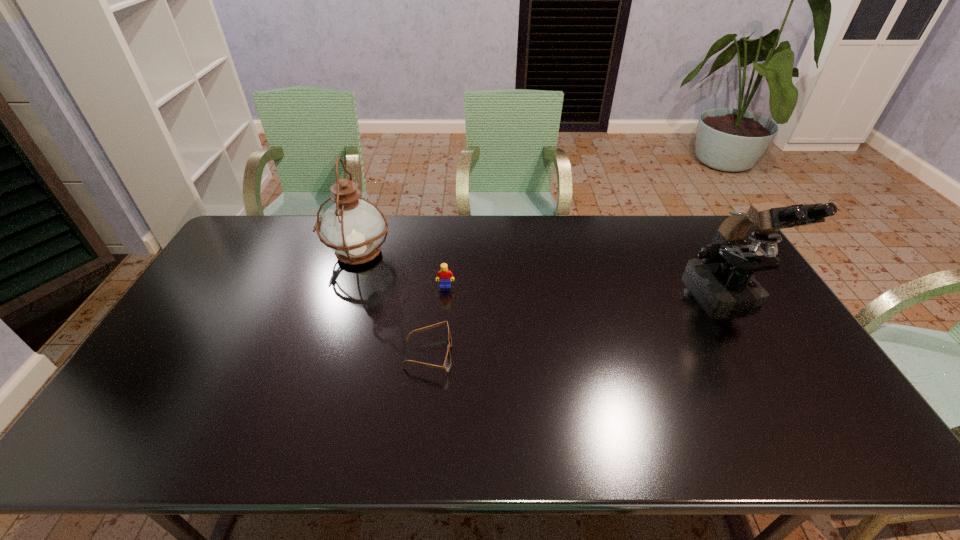
Locate an element on the screen. This screenshot has width=960, height=540. object at the right edge is located at coordinates (723, 271).

In the image, there is a desktop. In order to click on vacant space at the far edge in this screenshot , I will do `click(537, 218)`.

The image size is (960, 540). In the image, there is a desktop. Find the location of `free region at the near edge`. free region at the near edge is located at coordinates (491, 438).

This screenshot has height=540, width=960. What are the coordinates of `vacant space at the left edge of the desktop` in the screenshot? It's located at (175, 375).

In the image, there is a desktop. At what (x,y) coordinates should I click in order to perform the action: click on vacant space at the far left corner. Please return your answer as a coordinate pair (x, y). This screenshot has width=960, height=540. Looking at the image, I should click on (273, 224).

Find the location of a particular element. Image resolution: width=960 pixels, height=540 pixels. free spot at the near left corner of the desktop is located at coordinates (99, 435).

This screenshot has height=540, width=960. Find the location of `vacant space at the far right corner of the desktop`. vacant space at the far right corner of the desktop is located at coordinates (669, 218).

This screenshot has width=960, height=540. What are the coordinates of `unoccupied position between the Lego and the rightmost object` in the screenshot? It's located at (586, 289).

The image size is (960, 540). What are the coordinates of `empty space between the nearest object and the microscope` in the screenshot? It's located at (577, 323).

Locate an element on the screen. vacant space that is in between the rightmost object and the nearest object is located at coordinates (577, 323).